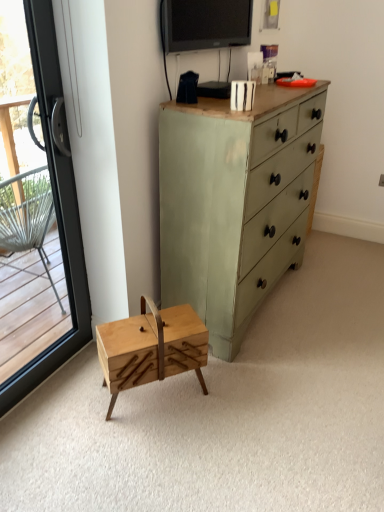
Identify the location of free space in front of green painted wood chest of drawers at center. (272, 394).